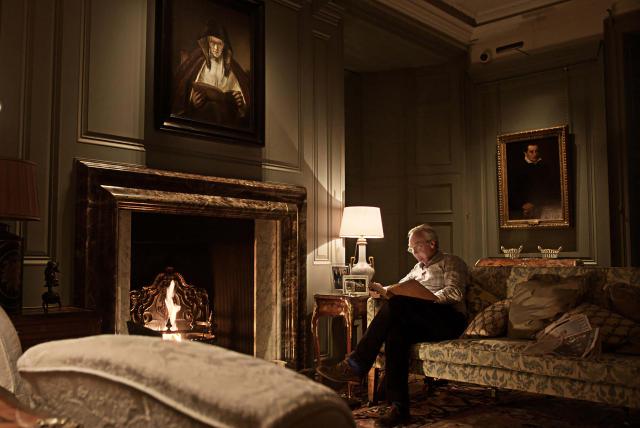
Image resolution: width=640 pixels, height=428 pixels. Identify the location of rug. (456, 397), (363, 414), (413, 379), (546, 408).